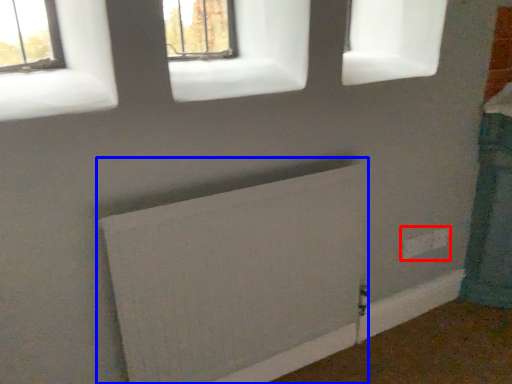
Question: Which object is closer to the camera taking this photo, electric outlet (highlighted by a red box) or radiator (highlighted by a blue box)?

Choices:
 (A) electric outlet
 (B) radiator

Answer: (B)